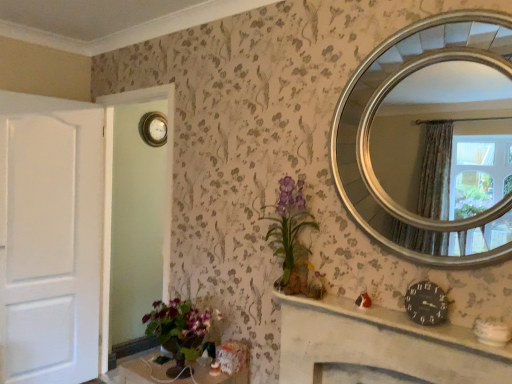
Image resolution: width=512 pixels, height=384 pixels. What do you see at coordinates (423, 137) in the screenshot?
I see `silver/golden mirror at upper right` at bounding box center [423, 137].

The image size is (512, 384). What do you see at coordinates (141, 370) in the screenshot?
I see `wooden table at lower left` at bounding box center [141, 370].

Image resolution: width=512 pixels, height=384 pixels. What are the coordinates of `black matte clock at lower right, acting as the second clock starting from the top` in the screenshot? It's located at (426, 303).

Measure the distance between point (29, 291) and camera.

Point (29, 291) is 8.89 feet from camera.

At what (x,y) coordinates should I click in order to perform the action: click on matte purple vase at center. Please return your answer as a coordinate pair (x, y). Looking at the image, I should click on (290, 234).

Between white matte door at left and black matte clock at lower right, which is the 1th clock in front-to-back order, which one appears on the left side from the viewer's perspective?

white matte door at left.

Would you say white matte door at left contains black matte clock at lower right, the first clock positioned from the right?

No, black matte clock at lower right, the first clock positioned from the right, is not surrounded by white matte door at left.

From a real-world perspective, which object rests below the other?

white matte door at left is physically lower.

How much distance is there between white matte door at left and black matte clock at lower right, arranged as the second clock when viewed from the back?

white matte door at left is 2.33 meters away from black matte clock at lower right, arranged as the second clock when viewed from the back.

Is matte purple vase at center in front of or behind wooden table at lower left in the image?

matte purple vase at center is positioned closer to the viewer than wooden table at lower left.

Are matte purple vase at center and wooden table at lower left making contact?

No.

From a real-world perspective, which is physically above, matte purple vase at center or wooden table at lower left?

matte purple vase at center.

I want to click on table below the matte purple vase at center (from a real-world perspective), so click(x=141, y=370).

Is point (432, 321) closer or farther from the camera than point (469, 79)?

Point (432, 321) is closer to the camera than point (469, 79).

What are the coordinates of `mirror above the black matte clock at lower right, positioned as the 1th clock in bottom-to-top order (from the image's perspective)` in the screenshot? It's located at (423, 137).

Considering the relative sizes of black matte clock at lower right, which is the 1th clock in front-to-back order, and silver/golden mirror at upper right in the image provided, is black matte clock at lower right, which is the 1th clock in front-to-back order, bigger than silver/golden mirror at upper right?

No.

Based on the photo, is black matte clock at lower right, arranged as the second clock when viewed from the back, in contact with silver/golden mirror at upper right?

No, black matte clock at lower right, arranged as the second clock when viewed from the back, is not next to silver/golden mirror at upper right.

Measure the distance between black clock at center and black matte clock at lower right, acting as the second clock starting from the top.

black clock at center and black matte clock at lower right, acting as the second clock starting from the top, are 9.05 inches apart.

Looking at this image, from the image's perspective, which is below, black clock at center or black matte clock at lower right, which is the second clock from left to right?

black clock at center is shown below in the image.

Is black clock at center not inside black matte clock at lower right, which is the second clock from left to right?

That's correct, black clock at center is outside of black matte clock at lower right, which is the second clock from left to right.

Consider the image. How many degrees apart are the facing directions of silver/golden mirror at upper right and white matte door at left?

The angle between the facing direction of silver/golden mirror at upper right and the facing direction of white matte door at left is 85.2 degrees.

From the image's perspective, would you say silver/golden mirror at upper right is shown under white matte door at left?

No.

Can you confirm if silver/golden mirror at upper right is shorter than white matte door at left?

Correct, silver/golden mirror at upper right is not as tall as white matte door at left.

Find the location of `floral arrangement above the black clock at center (from the image's perspective)`. floral arrangement above the black clock at center (from the image's perspective) is located at coordinates (290, 234).

Looking at this image, from the image's perspective, relative to black clock at center, is matte purple vase at center above or below?

From the image's perspective, matte purple vase at center appears above black clock at center.

From a real-world perspective, is matte purple vase at center physically above black clock at center?

Yes, from a real-world perspective, matte purple vase at center is above black clock at center.

Between wooden table at lower left and black matte clock at lower right, which is the 1th clock in front-to-back order, which one has less height?

With less height is black matte clock at lower right, which is the 1th clock in front-to-back order.

Is wooden table at lower left behind black matte clock at lower right, positioned as the 1th clock in bottom-to-top order?

Yes, wooden table at lower left is behind black matte clock at lower right, positioned as the 1th clock in bottom-to-top order.

From a real-world perspective, which is physically below, wooden table at lower left or black matte clock at lower right, positioned as the 1th clock in bottom-to-top order?

In real-world perspective, wooden table at lower left is lower.

Is wooden table at lower left turned away from black matte clock at lower right, which is the second clock from left to right?

No.

From a real-world perspective, count 1st clocks upward from the white matte door at left and point to it. Please provide its 2D coordinates.

[(426, 303)]

The width and height of the screenshot is (512, 384). Identify the location of floral arrangement located on the right of wooden table at lower left. (290, 234).

Based on their spatial positions, is black matte clock at lower right, acting as the second clock starting from the top, or white matte door at left further from metallic round clock at upper center, which is counted as the 2th clock, starting from the right?

Based on the image, black matte clock at lower right, acting as the second clock starting from the top, appears to be further to metallic round clock at upper center, which is counted as the 2th clock, starting from the right.

Based on their spatial positions, is wooden table at lower left or gold metallic clock at upper left closer to black clock at center?

wooden table at lower left is closer to black clock at center.

Considering their positions, is metallic round clock at upper center, the 2th clock viewed from the front, positioned closer to wooden table at lower left than gold metallic clock at upper left?

Based on the image, gold metallic clock at upper left appears to be nearer to wooden table at lower left.

Based on the photo, based on their spatial positions, is white matte door at left or black matte clock at lower right, acting as the second clock starting from the top, further from gold metallic clock at upper left?

The object further to gold metallic clock at upper left is black matte clock at lower right, acting as the second clock starting from the top.

Considering their positions, is black clock at center positioned closer to gold metallic clock at upper left than black matte clock at lower right, acting as the second clock starting from the top?

Among the two, black clock at center is located nearer to gold metallic clock at upper left.

Which object lies further to the anchor point wooden table at lower left, white matte door at left or black matte clock at lower right, which is the second clock from left to right?

black matte clock at lower right, which is the second clock from left to right, is positioned further to the anchor wooden table at lower left.

Which object lies nearer to the anchor point matte purple vase at center, silver/golden mirror at upper right or black clock at center?

The object closer to matte purple vase at center is black clock at center.

In the scene shown: Which object lies nearer to the anchor point metallic round clock at upper center, which is counted as the 2th clock, starting from the right, white matte door at left or matte purple vase at center?

Among the two, white matte door at left is located nearer to metallic round clock at upper center, which is counted as the 2th clock, starting from the right.

Identify the location of door located between wooden table at lower left and metallic round clock at upper center, the second clock positioned from the bottom, in the depth direction. This screenshot has width=512, height=384. (50, 238).

I want to click on table positioned between matte purple vase at center and metallic round clock at upper center, which appears as the 1th clock when viewed from the left, from near to far, so click(x=141, y=370).

I want to click on floral arrangement between silver/golden mirror at upper right and wooden table at lower left from top to bottom, so click(x=290, y=234).

You are a GUI agent. You are given a task and a screenshot of the screen. Output one action in this format:
    pyautogui.click(x=<x>, y=<y>)
    Task: Click on the glass door positioned between black matte clock at lower right, which is the 1th clock in front-to-back order, and metallic round clock at upper center, the 2th clock viewed from the front, from near to far
    The height and width of the screenshot is (384, 512).
    Given the screenshot: What is the action you would take?
    pyautogui.click(x=137, y=206)